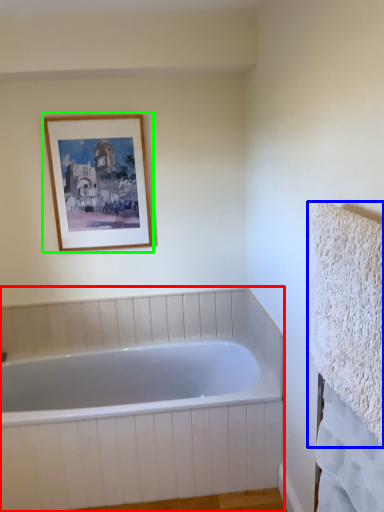
Question: Estimate the real-world distances between objects in this image. Which object is farther from bathtub (highlighted by a red box), bath towel (highlighted by a blue box) or picture frame (highlighted by a green box)?

Choices:
 (A) bath towel
 (B) picture frame

Answer: (A)